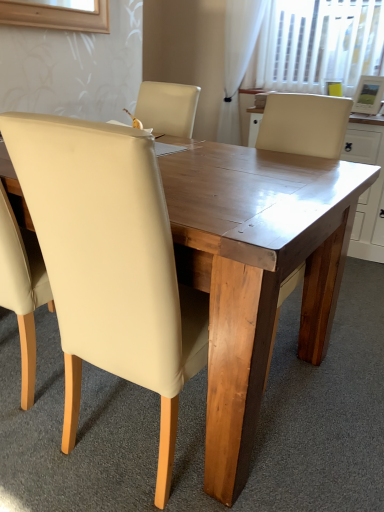
Question: Is beige leather chair at center wider or thinner than white sheer curtain at upper right?

Choices:
 (A) thin
 (B) wide

Answer: (B)

Question: From the image's perspective, is beige leather chair at center above or below white sheer curtain at upper right?

Choices:
 (A) above
 (B) below

Answer: (B)

Question: From a real-world perspective, is beige leather chair at center above or below white sheer curtain at upper right?

Choices:
 (A) above
 (B) below

Answer: (B)

Question: From the image's perspective, is white sheer curtain at upper right above or below beige leather chair at center?

Choices:
 (A) below
 (B) above

Answer: (B)

Question: Looking at the image, does white sheer curtain at upper right seem bigger or smaller compared to beige leather chair at center?

Choices:
 (A) small
 (B) big

Answer: (A)

Question: Which is correct: white sheer curtain at upper right is inside beige leather chair at center, or outside of it?

Choices:
 (A) inside
 (B) outside

Answer: (B)

Question: In terms of width, does white sheer curtain at upper right look wider or thinner when compared to beige leather chair at center?

Choices:
 (A) wide
 (B) thin

Answer: (B)